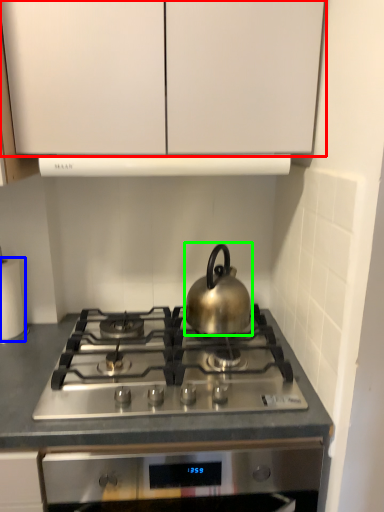
Question: Based on their relative distances, which object is farther from cabinetry (highlighted by a red box)? Choose from paper towel (highlighted by a blue box) and kettle (highlighted by a green box).

Choices:
 (A) paper towel
 (B) kettle

Answer: (A)